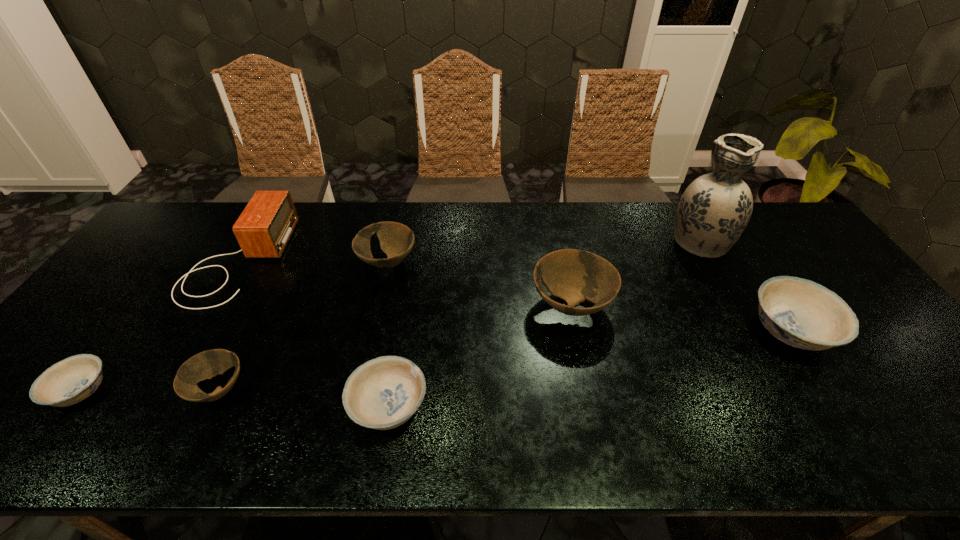
Find the location of a particular element. The width and height of the screenshot is (960, 540). blue vase is located at coordinates (714, 210).

Identify the location of the tallest object. The width and height of the screenshot is (960, 540). (714, 210).

Find the location of a particular element. This screenshot has width=960, height=540. radio receiver is located at coordinates (264, 228).

This screenshot has width=960, height=540. Find the location of `the tallest bowl`. the tallest bowl is located at coordinates (574, 275).

The image size is (960, 540). Identify the location of the biggest brown bowl. coord(574,275).

Identify the location of the second smallest brown bowl. (396, 240).

Find the location of `the rightmost blue bowl`. the rightmost blue bowl is located at coordinates (801, 313).

At what (x,y) coordinates should I click in order to perform the action: click on the rightmost bowl. Please return your answer as a coordinate pair (x, y). This screenshot has width=960, height=540. Looking at the image, I should click on (801, 313).

Locate an element on the screen. This screenshot has width=960, height=540. the second smallest blue bowl is located at coordinates (383, 393).

You are a GUI agent. You are given a task and a screenshot of the screen. Output one action in this format:
    pyautogui.click(x=<x>, y=<y>)
    Task: Click on the leftmost brown bowl
    
    Given the screenshot: What is the action you would take?
    pyautogui.click(x=207, y=364)